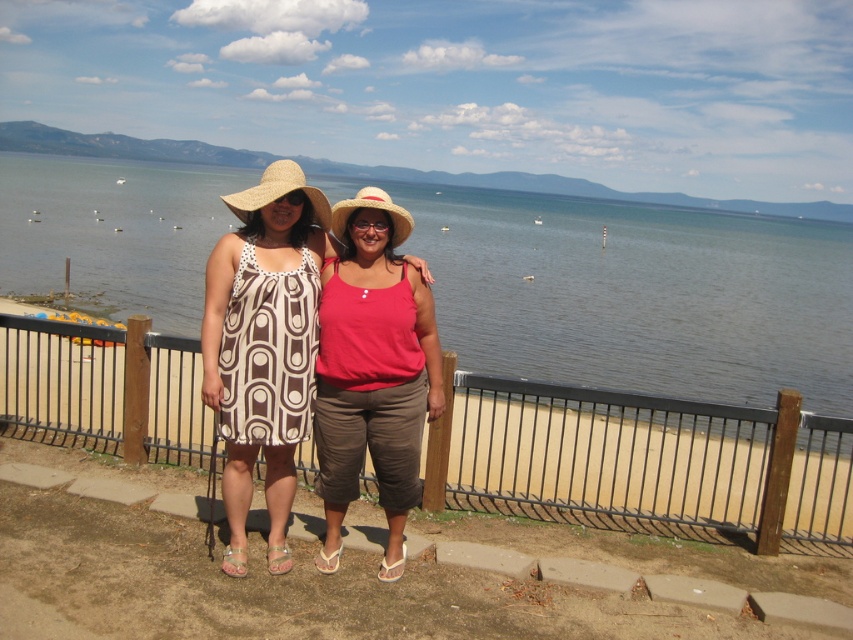
Who is higher up, metallic black fence at center or matte pink tank top at center?

Positioned higher is matte pink tank top at center.

The height and width of the screenshot is (640, 853). What do you see at coordinates (646, 458) in the screenshot?
I see `metallic black fence at center` at bounding box center [646, 458].

This screenshot has height=640, width=853. In order to click on metallic black fence at center in this screenshot , I will do `click(646, 458)`.

This screenshot has height=640, width=853. Describe the element at coordinates (646, 458) in the screenshot. I see `metallic black fence at center` at that location.

Who is more forward, [524,428] or [238,573]?

Point [238,573] is more forward.

You are a GUI agent. You are given a task and a screenshot of the screen. Output one action in this format:
    pyautogui.click(x=<x>, y=<y>)
    Task: Click on the metallic black fence at center
    The width and height of the screenshot is (853, 640).
    Given the screenshot: What is the action you would take?
    pyautogui.click(x=646, y=458)

Is blue water at center to the left of brown textured dress at center from the viewer's perspective?

Yes, blue water at center is to the left of brown textured dress at center.

Can you confirm if blue water at center is positioned below brown textured dress at center?

No.

Image resolution: width=853 pixels, height=640 pixels. In order to click on blue water at center in this screenshot , I will do `click(636, 294)`.